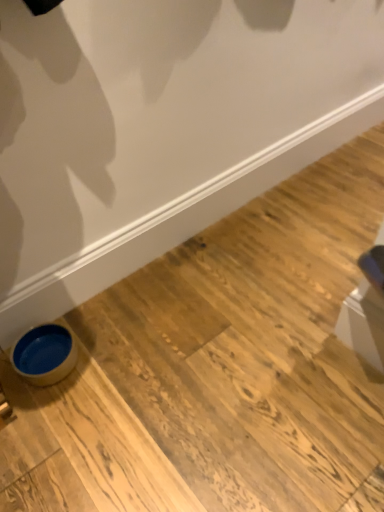
Locate an element on the screen. The image size is (384, 512). vacant area to the right of matte blue bowl at lower left is located at coordinates (112, 360).